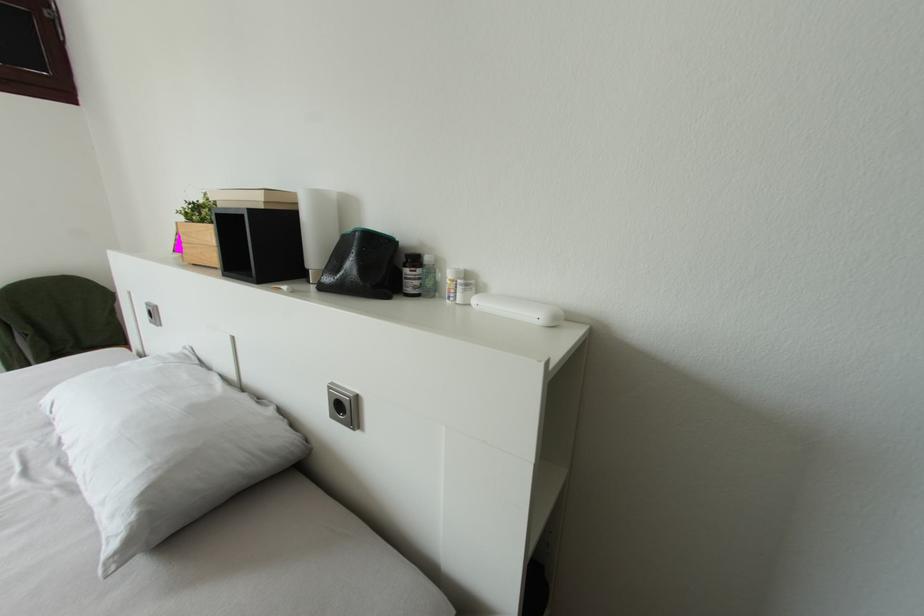
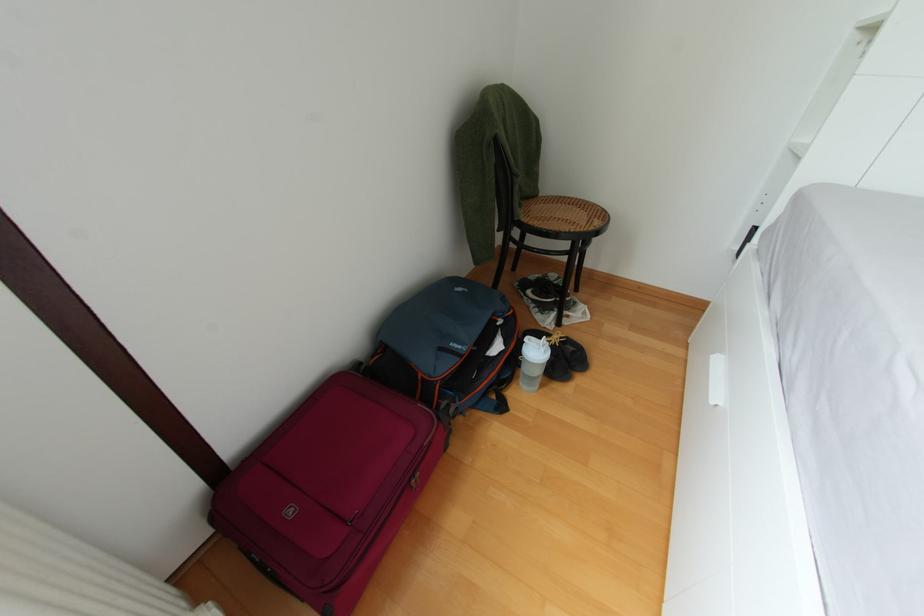
Question: Which direction would the cameraman need to move to produce the second image? Reply with the corresponding letter.

Choices:
 (A) Left
 (B) Right
 (C) Forward
 (D) Backward

Answer: (A)